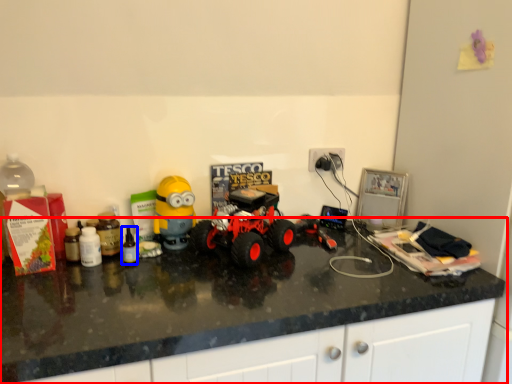
Question: Which object is further to the camera taking this photo, countertop (highlighted by a red box) or bottle (highlighted by a blue box)?

Choices:
 (A) countertop
 (B) bottle

Answer: (B)